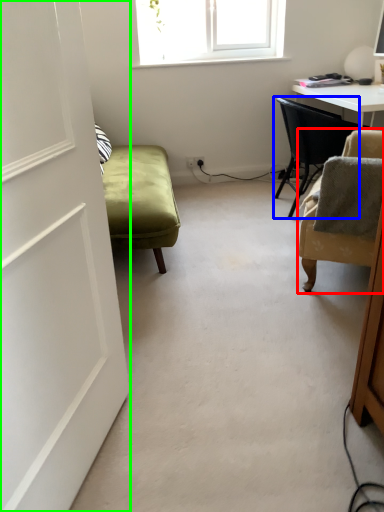
Question: Based on their relative distances, which object is farther from chair (highlighted by a red box)? Choose from chair (highlighted by a blue box) and door (highlighted by a green box).

Choices:
 (A) chair
 (B) door

Answer: (B)